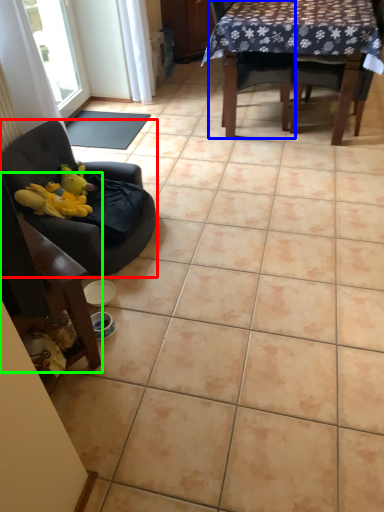
Question: Which object is positioned closest to chair (highlighted by a red box)? Select from chair (highlighted by a blue box) and chair (highlighted by a green box).

Choices:
 (A) chair
 (B) chair

Answer: (B)